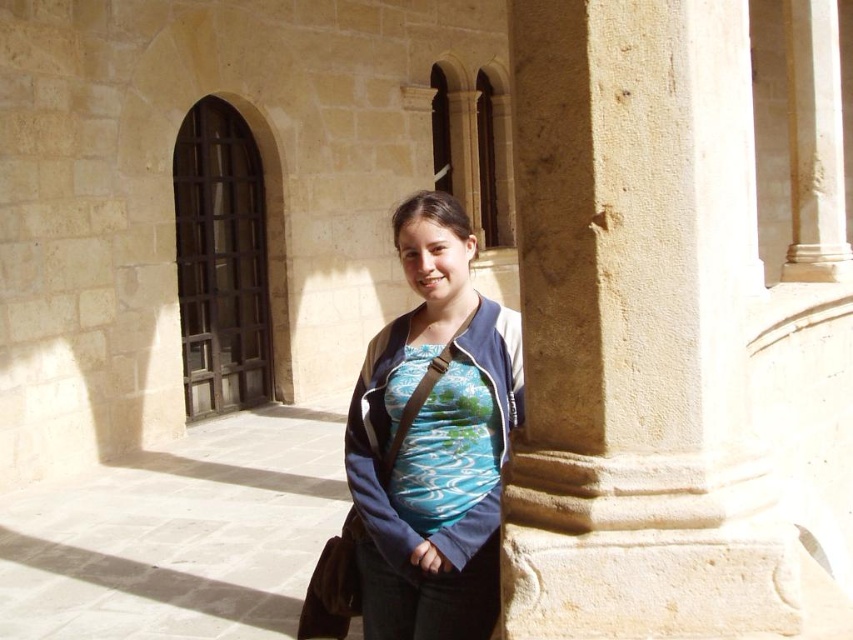
Question: Which point appears closest to the camera in this image?

Choices:
 (A) (422, 451)
 (B) (496, 502)
 (C) (642, 579)

Answer: (C)

Question: Can you confirm if beige stone pillar at center is positioned to the left of blue fabric shirt at center?

Choices:
 (A) yes
 (B) no

Answer: (B)

Question: Which point is closer to the camera taking this photo?

Choices:
 (A) (450, 369)
 (B) (468, 492)

Answer: (B)

Question: Is beige stone pillar at center bigger than textured fabric shirt at center?

Choices:
 (A) no
 (B) yes

Answer: (B)

Question: Estimate the real-world distances between objects in this image. Which object is farther from the textured fabric shirt at center?

Choices:
 (A) blue fabric shirt at center
 (B) beige stone pillar at center

Answer: (B)

Question: Considering the relative positions of blue fabric shirt at center and textured fabric shirt at center in the image provided, where is blue fabric shirt at center located with respect to textured fabric shirt at center?

Choices:
 (A) right
 (B) left

Answer: (B)